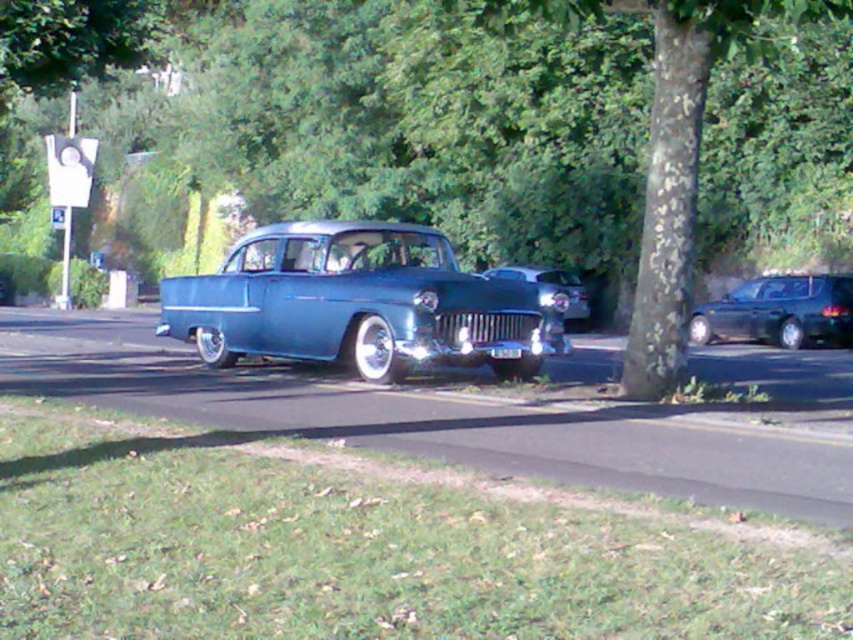
Can you confirm if shiny chrome car at center is smaller than white plastic license plate at center?

Actually, shiny chrome car at center might be larger than white plastic license plate at center.

The height and width of the screenshot is (640, 853). What do you see at coordinates (550, 289) in the screenshot? I see `shiny chrome car at center` at bounding box center [550, 289].

Is point (534, 273) in front of point (497, 349)?

No, (534, 273) is behind (497, 349).

At what (x,y) coordinates should I click in order to perform the action: click on shiny chrome car at center. Please return your answer as a coordinate pair (x, y). Looking at the image, I should click on (550, 289).

Looking at this image, between metallic blue pickup truck at center and shiny black sedan at right, which one has less height?

shiny black sedan at right

Between point (496, 284) and point (840, 342), which one is positioned behind?

Point (840, 342)

Locate an element on the screen. This screenshot has height=640, width=853. metallic blue pickup truck at center is located at coordinates (358, 304).

Is shiny black sedan at right positioned behind white plastic license plate at center?

Yes, shiny black sedan at right is further from the viewer.

Between shiny black sedan at right and white plastic license plate at center, which one appears on the right side from the viewer's perspective?

Positioned to the right is shiny black sedan at right.

Who is more forward, (x=787, y=275) or (x=512, y=353)?

Point (x=512, y=353)

Where is `shiny black sedan at right`? shiny black sedan at right is located at coordinates (779, 310).